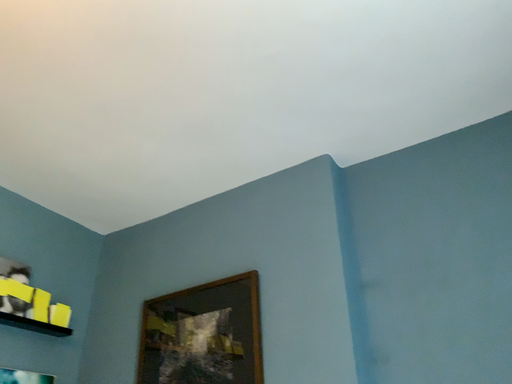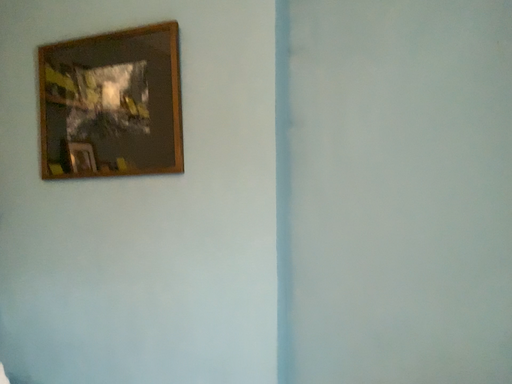
Question: Which way did the camera rotate in the video?

Choices:
 (A) rotated left
 (B) rotated right

Answer: (B)